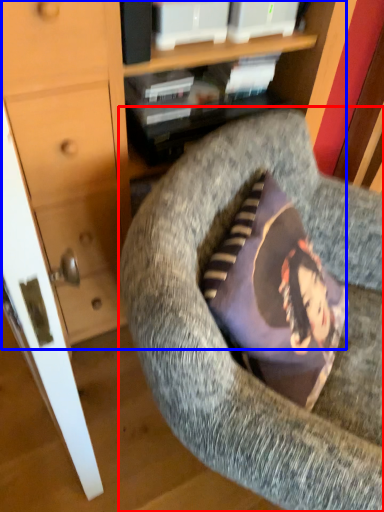
Question: Among these objects, which one is nearest to the camera, chair (highlighted by a red box) or dresser (highlighted by a blue box)?

Choices:
 (A) chair
 (B) dresser

Answer: (A)